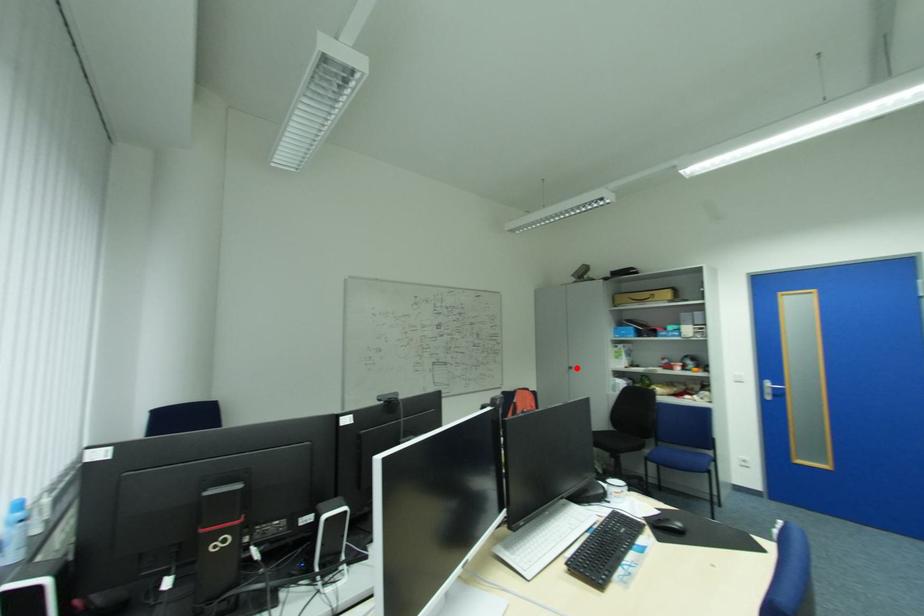
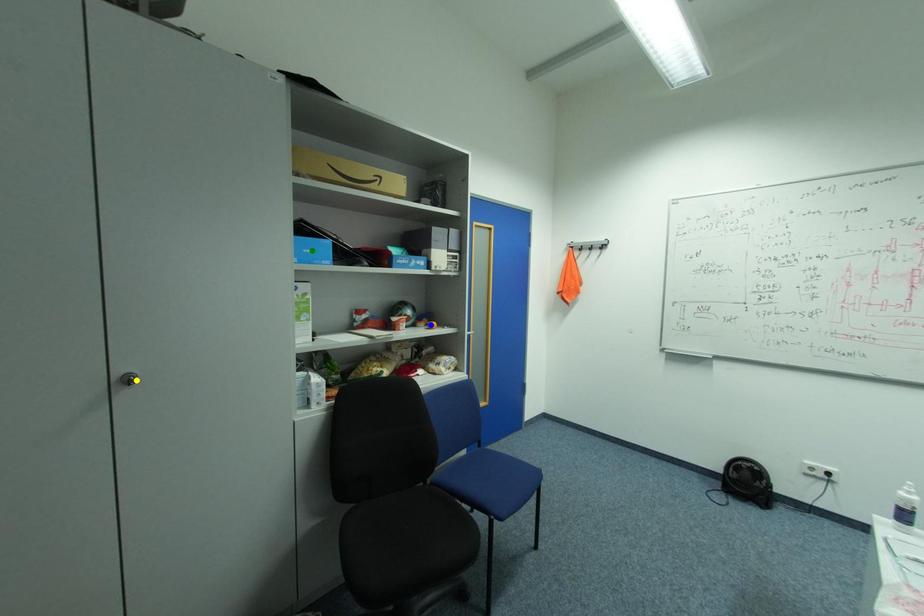
Question: I am providing you with two images of the same scene from different viewpoints. A red point is marked on the first image. You are given multiple points on the second image. Which point in image 2 is actually the same real-world point as the red point in image 1?

Choices:
 (A) blue point
 (B) green point
 (C) yellow point

Answer: (C)